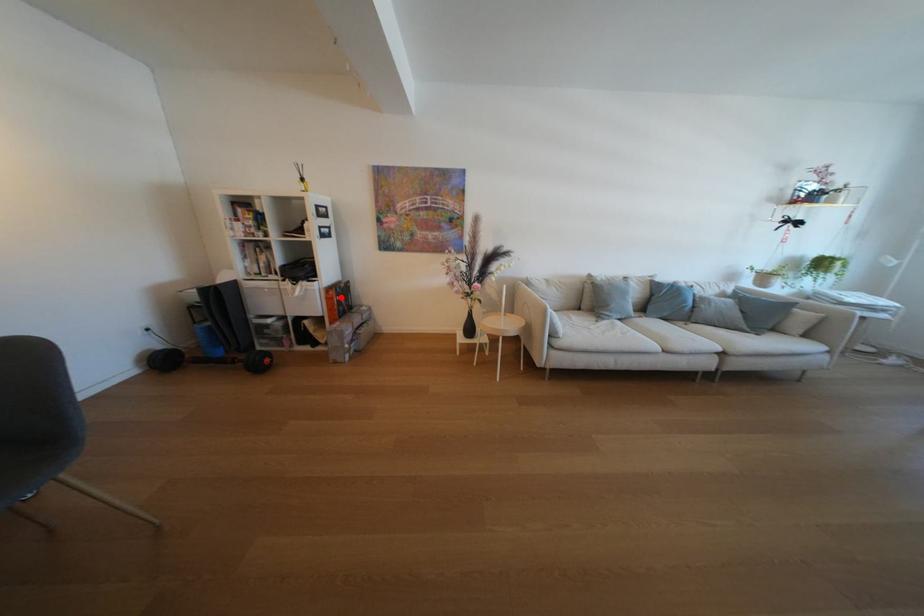
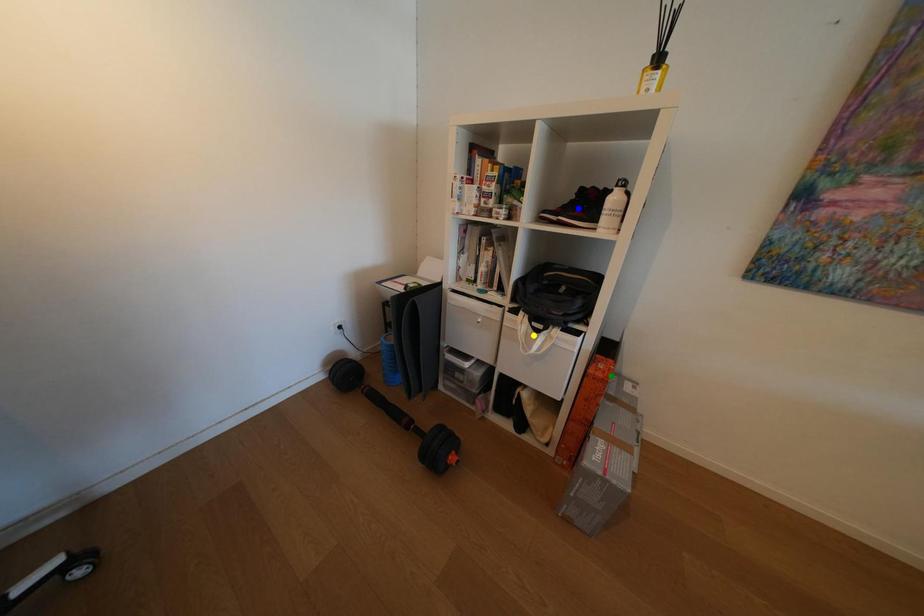
Question: I am providing you with two images of the same scene from different viewpoints. A red point is marked on the first image. You are given multiple points on the second image. Which point in image 2 represents the same 3d spot as the red point in image 1?

Choices:
 (A) blue point
 (B) green point
 (C) yellow point

Answer: (B)